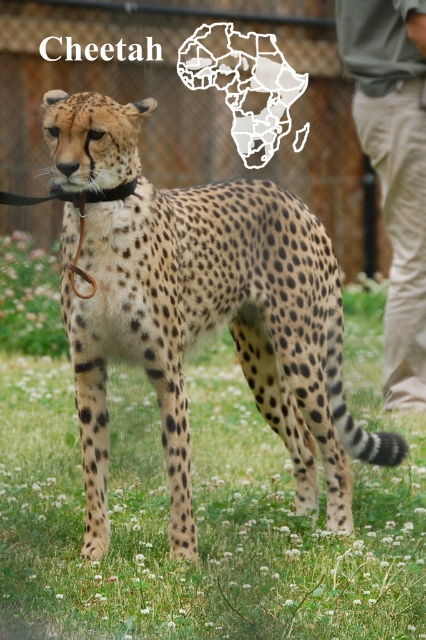
Question: Which object appears farthest from the camera in this image?

Choices:
 (A) green grass at center
 (B) spotted fur cheetah at center
 (C) black leather neckband at center

Answer: (B)

Question: Considering the relative positions of green grass at center and spotted fur cheetah at center in the image provided, where is green grass at center located with respect to spotted fur cheetah at center?

Choices:
 (A) right
 (B) left

Answer: (B)

Question: Which point is closer to the camera?

Choices:
 (A) spotted fur cheetah at center
 (B) black leather neckband at center
 (C) green grass at center

Answer: (C)

Question: Is green grass at center below black leather neckband at center?

Choices:
 (A) yes
 (B) no

Answer: (A)

Question: Which point is closer to the camera taking this photo?

Choices:
 (A) (178, 284)
 (B) (75, 205)

Answer: (B)

Question: Is the position of green grass at center less distant than that of spotted fur cheetah at center?

Choices:
 (A) no
 (B) yes

Answer: (B)